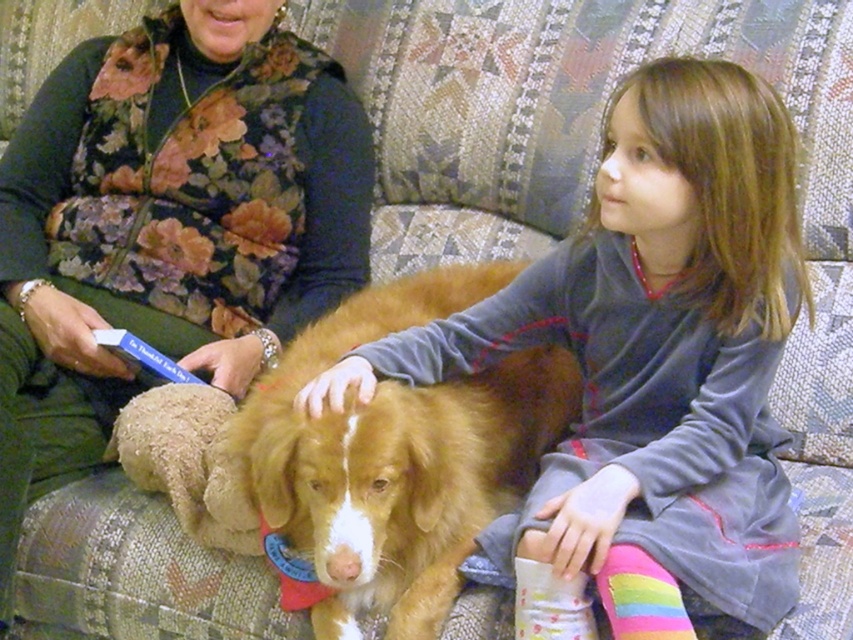
Question: Which of the following is the closest to the observer?

Choices:
 (A) velvety gray dress at center
 (B) white cotton sock at lower center
 (C) floral-patterned vest at upper left

Answer: (A)

Question: Can you confirm if velvety gray dress at center is bigger than floral-patterned vest at upper left?

Choices:
 (A) no
 (B) yes

Answer: (A)

Question: Can you confirm if velvety gray dress at center is bigger than rainbow striped sock at lower right?

Choices:
 (A) no
 (B) yes

Answer: (B)

Question: Which point appears farthest from the camera in this image?

Choices:
 (A) (491, 568)
 (B) (589, 600)

Answer: (A)

Question: Is floral-patterned vest at upper left to the right of white cotton sock at lower center from the viewer's perspective?

Choices:
 (A) yes
 (B) no

Answer: (B)

Question: Which point appears farthest from the camera in this image?

Choices:
 (A) (138, 228)
 (B) (450, 280)
 (C) (581, 580)

Answer: (A)